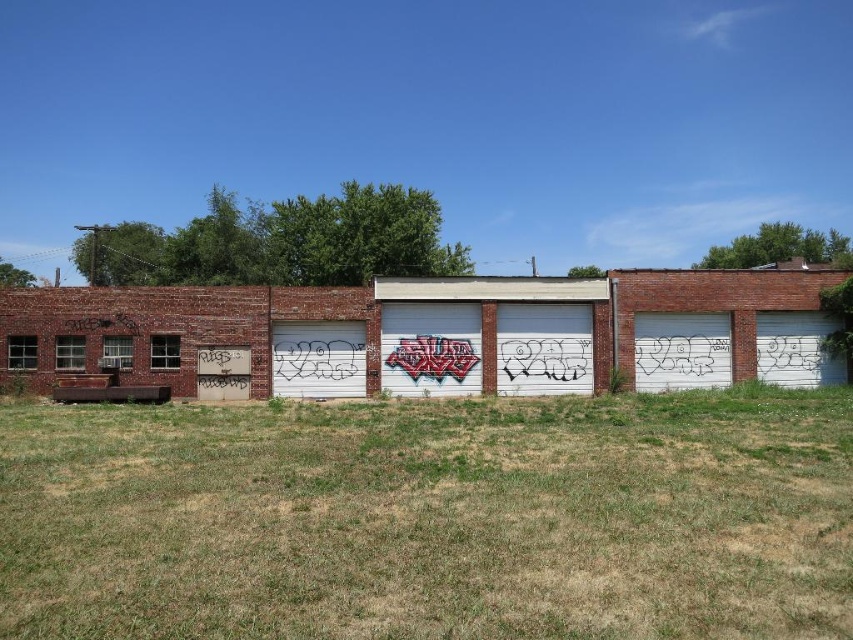
Which is more to the left, green grass at lower center or white matte garage door at center?

From the viewer's perspective, white matte garage door at center appears more on the left side.

Is point (775, 516) less distant than point (296, 332)?

Yes, it is.

Is point (474, 476) positioned before point (283, 326)?

Yes, point (474, 476) is in front of point (283, 326).

Find the location of a particular element. green grass at lower center is located at coordinates (431, 516).